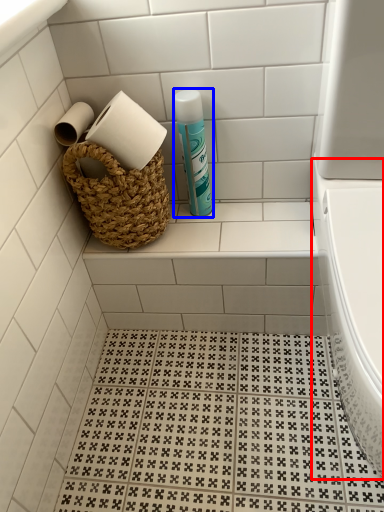
Question: Among these objects, which one is farthest to the camera, bath (highlighted by a red box) or cleaning product (highlighted by a blue box)?

Choices:
 (A) bath
 (B) cleaning product

Answer: (B)